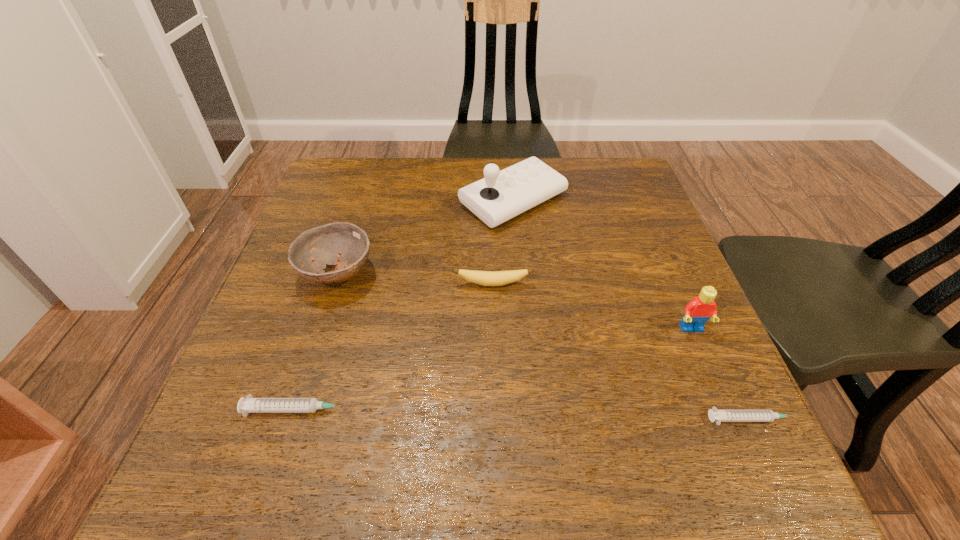
The image size is (960, 540). In order to click on free space located 0.110m at the needle end of the left syringe in this screenshot , I will do `click(420, 409)`.

The width and height of the screenshot is (960, 540). Find the location of `vacant space located on the front of the farthest object`. vacant space located on the front of the farthest object is located at coordinates (519, 271).

At what (x,y) coordinates should I click in order to perform the action: click on vacant space located 0.120m on the back of the bowl. Please return your answer as a coordinate pair (x, y). This screenshot has height=540, width=960. Looking at the image, I should click on (356, 218).

Identify the location of free space located 0.160m on the face of the fourth farthest object. (728, 414).

This screenshot has width=960, height=540. I want to click on vacant space located on the back of the banana, so click(x=491, y=191).

Locate an element on the screen. This screenshot has width=960, height=540. object at the far edge is located at coordinates (502, 195).

Identify the location of syringe that is at the left edge. (249, 405).

Find the location of a particular element. The image size is (960, 540). bowl located in the left edge section of the desktop is located at coordinates (323, 244).

Where is `syringe present at the right edge`? This screenshot has width=960, height=540. syringe present at the right edge is located at coordinates (718, 416).

Where is `Lego located in the right edge section of the desktop`? This screenshot has height=540, width=960. Lego located in the right edge section of the desktop is located at coordinates (697, 312).